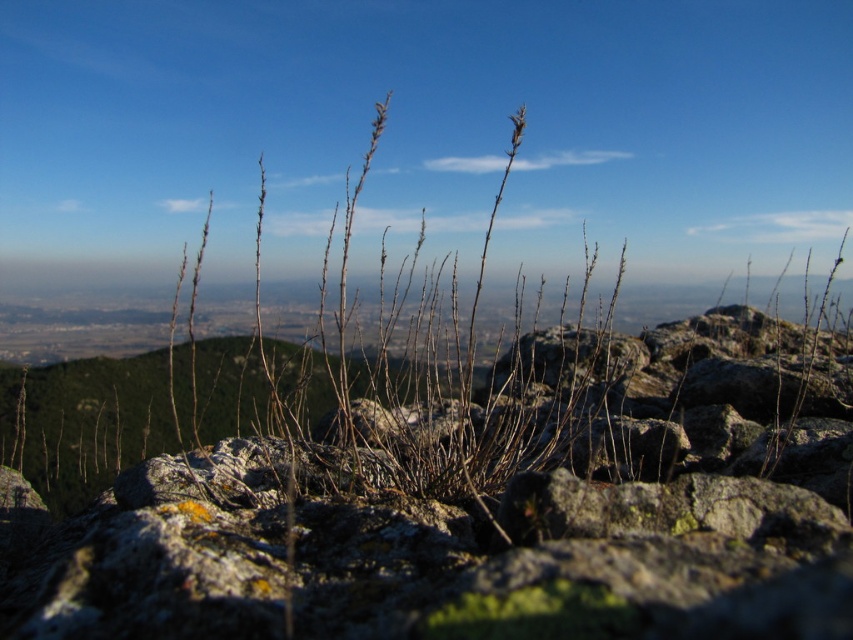
You are a hiker who wants to cross the valley. You see a gray rough rock at center and a brown dry grass at center. Which path is more stable to walk on?

The gray rough rock at center is more stable to walk on than the brown dry grass at center because rocks are generally more solid and less likely to shift underfoot compared to dry grass.

You are a hiker who wants to place a small backpack between the gray rough rock at center and the brown dry grass at center. Which object should you place the backpack closer to if you want it to be more noticeable against the background?

You should place the backpack closer to the brown dry grass at center because it is larger than the gray rough rock at center, making the backpack more noticeable against the background.

You are a hiker who wants to take a photo of the gray rough rock at center and the brown dry grass at center. Which object will appear taller in your photo?

The brown dry grass at center will appear taller in the photo because it is taller than the gray rough rock at center.